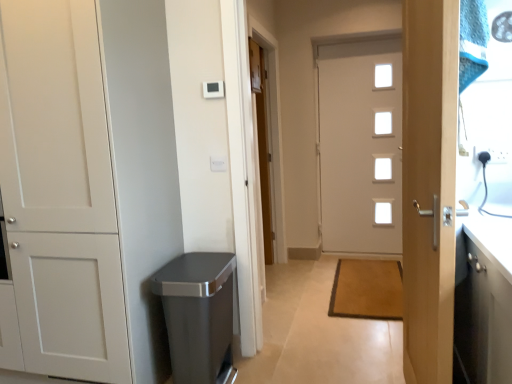
Question: Does white matte cabinet at left, positioned as the first door in left-to-right order, have a smaller size compared to brown textured mat at center?

Choices:
 (A) no
 (B) yes

Answer: (A)

Question: Could you tell me if white matte cabinet at left, positioned as the first door in left-to-right order, is turned towards brown textured mat at center?

Choices:
 (A) no
 (B) yes

Answer: (A)

Question: From a real-world perspective, is white matte cabinet at left, which ranks as the fourth door in right-to-left order, positioned under brown textured mat at center based on gravity?

Choices:
 (A) yes
 (B) no

Answer: (B)

Question: Does white matte cabinet at left, positioned as the third door in back-to-front order, have a lesser height compared to brown textured mat at center?

Choices:
 (A) no
 (B) yes

Answer: (A)

Question: Is white matte cabinet at left, arranged as the second door when viewed from the front, at the left side of brown textured mat at center?

Choices:
 (A) yes
 (B) no

Answer: (A)

Question: Considering the positions of brown textured mat at center and white matte cabinet at left, positioned as the first door in left-to-right order, in the image, is brown textured mat at center wider or thinner than white matte cabinet at left, positioned as the first door in left-to-right order,?

Choices:
 (A) wide
 (B) thin

Answer: (A)

Question: From the image's perspective, relative to white matte cabinet at left, positioned as the first door in left-to-right order, is brown textured mat at center above or below?

Choices:
 (A) below
 (B) above

Answer: (A)

Question: Relative to white matte cabinet at left, arranged as the second door when viewed from the front, is brown textured mat at center in front or behind?

Choices:
 (A) behind
 (B) front

Answer: (A)

Question: Is brown textured mat at center taller or shorter than white matte cabinet at left, which ranks as the fourth door in right-to-left order?

Choices:
 (A) tall
 (B) short

Answer: (B)

Question: Considering the positions of light wood door handle at right, which ranks as the 1th door in front-to-back order, and white glossy door at center, the second door from the back, in the image, is light wood door handle at right, which ranks as the 1th door in front-to-back order, bigger or smaller than white glossy door at center, the second door from the back,?

Choices:
 (A) big
 (B) small

Answer: (B)

Question: Considering the relative positions of light wood door handle at right, acting as the second door starting from the right, and white glossy door at center, acting as the fourth door starting from the left, in the image provided, is light wood door handle at right, acting as the second door starting from the right, to the left or to the right of white glossy door at center, acting as the fourth door starting from the left,?

Choices:
 (A) right
 (B) left

Answer: (B)

Question: Considering the positions of light wood door handle at right, placed as the 4th door when sorted from back to front, and white glossy door at center, the 1th door when ordered from right to left, in the image, is light wood door handle at right, placed as the 4th door when sorted from back to front, wider or thinner than white glossy door at center, the 1th door when ordered from right to left,?

Choices:
 (A) thin
 (B) wide

Answer: (A)

Question: From the image's perspective, is light wood door handle at right, placed as the 4th door when sorted from back to front, above or below white glossy door at center, the second door from the back?

Choices:
 (A) below
 (B) above

Answer: (A)

Question: Would you say white glossy door at center, marked as the fourth door in a front-to-back arrangement, is to the left or to the right of white glossy door at center, the second door from the back, in the picture?

Choices:
 (A) left
 (B) right

Answer: (A)

Question: In terms of height, does white glossy door at center, positioned as the third door in right-to-left order, look taller or shorter compared to white glossy door at center, the 1th door when ordered from right to left?

Choices:
 (A) short
 (B) tall

Answer: (A)